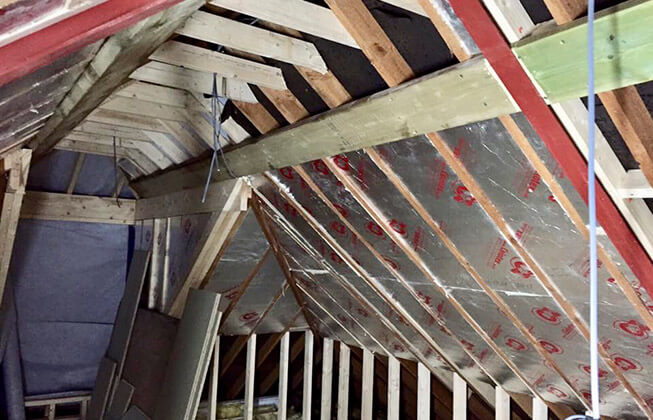
Where is `support beams`? The width and height of the screenshot is (653, 420). support beams is located at coordinates (381, 50), (332, 81), (281, 102), (255, 115).